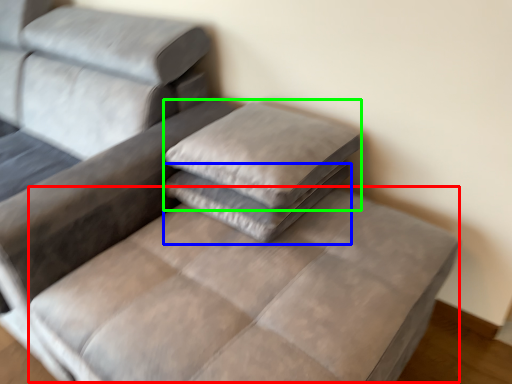
Question: Which object is positioned farthest from mattress (highlighted by a red box)? Select from pillow (highlighted by a blue box) and pillow (highlighted by a green box).

Choices:
 (A) pillow
 (B) pillow

Answer: (B)